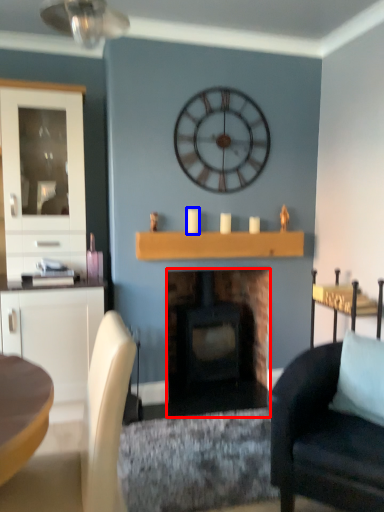
Question: Among these objects, which one is nearest to the camera, fireplace (highlighted by a red box) or candle (highlighted by a blue box)?

Choices:
 (A) fireplace
 (B) candle

Answer: (B)